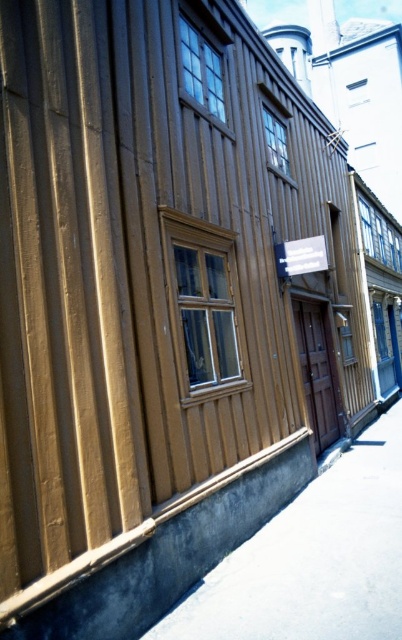
Question: Is gray concrete pavement at lower center further to camera compared to clear glass window at upper center?

Choices:
 (A) yes
 (B) no

Answer: (B)

Question: Which point is farther to the camera?

Choices:
 (A) wooden window at center
 (B) clear glass window at upper center
 (C) clear glass window at upper right

Answer: (C)

Question: Which point is farther to the camera?

Choices:
 (A) clear glass window at center
 (B) clear glass window at upper center
 (C) wooden window at center

Answer: (A)

Question: Among these objects, which one is nearest to the camera?

Choices:
 (A) gray concrete pavement at lower center
 (B) clear glass window at center

Answer: (A)

Question: From the image, what is the correct spatial relationship of gray concrete pavement at lower center in relation to clear glass window at upper center?

Choices:
 (A) right
 (B) left

Answer: (A)

Question: Does clear glass window at upper center appear on the right side of clear glass window at center?

Choices:
 (A) no
 (B) yes

Answer: (A)